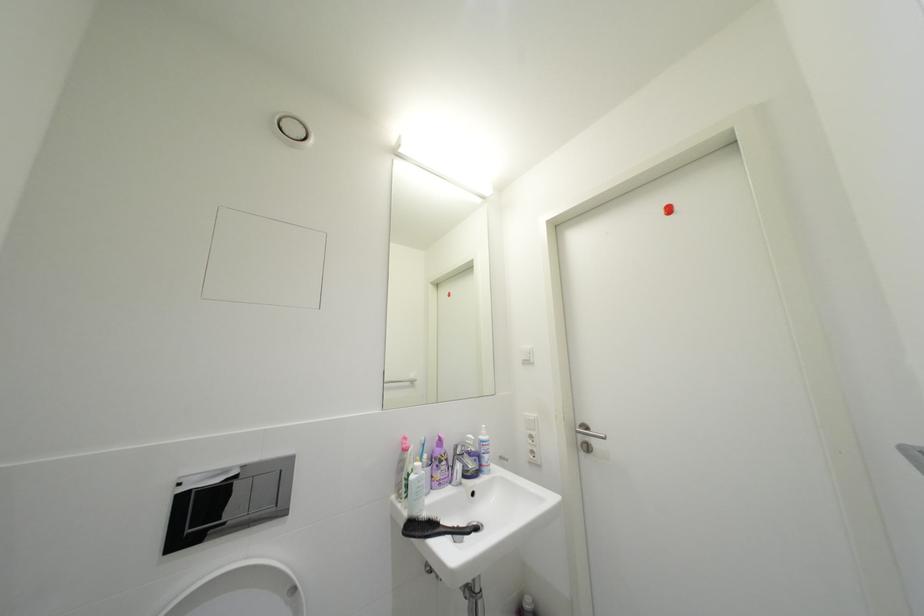
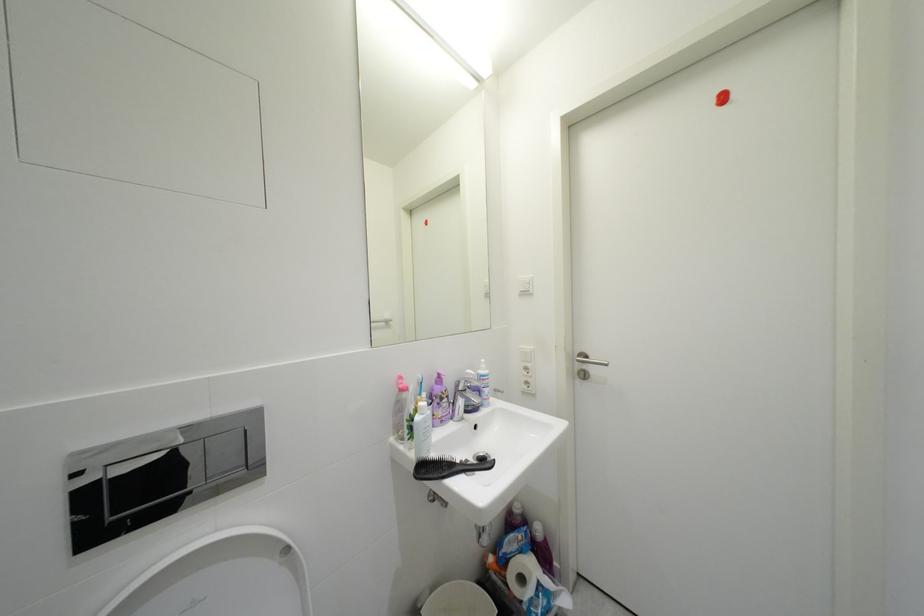
Question: The images are taken continuously from a first-person perspective. In which direction is your viewpoint rotating?

Choices:
 (A) Left
 (B) Right
 (C) Up
 (D) Down

Answer: (D)